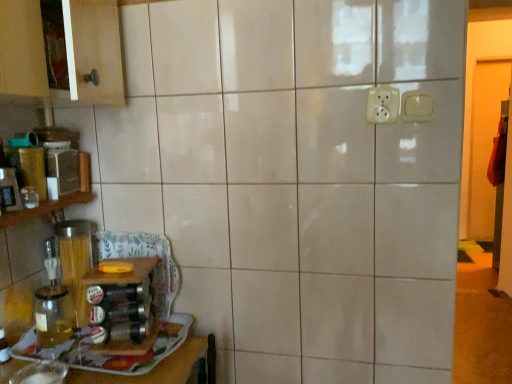
Question: Are wooden shelf at left and matte plastic container at left located far from each other?

Choices:
 (A) yes
 (B) no

Answer: (B)

Question: From the image's perspective, is wooden shelf at left on top of matte plastic container at left?

Choices:
 (A) yes
 (B) no

Answer: (B)

Question: Could you tell me if wooden shelf at left is turned towards matte plastic container at left?

Choices:
 (A) yes
 (B) no

Answer: (A)

Question: Can you confirm if wooden shelf at left is positioned to the right of matte plastic container at left?

Choices:
 (A) no
 (B) yes

Answer: (A)

Question: From a real-world perspective, does wooden shelf at left stand above matte plastic container at left?

Choices:
 (A) no
 (B) yes

Answer: (A)

Question: From the image's perspective, is wooden shelf at left located beneath matte plastic container at left?

Choices:
 (A) no
 (B) yes

Answer: (B)

Question: Is transparent glass jar at left positioned behind matte plastic container at left?

Choices:
 (A) yes
 (B) no

Answer: (B)

Question: Can you confirm if transparent glass jar at left is wider than matte plastic container at left?

Choices:
 (A) yes
 (B) no

Answer: (A)

Question: Does transparent glass jar at left have a smaller size compared to matte plastic container at left?

Choices:
 (A) no
 (B) yes

Answer: (B)

Question: Considering the relative sizes of transparent glass jar at left and matte plastic container at left in the image provided, is transparent glass jar at left taller than matte plastic container at left?

Choices:
 (A) no
 (B) yes

Answer: (A)

Question: Is transparent glass jar at left with matte plastic container at left?

Choices:
 (A) no
 (B) yes

Answer: (A)

Question: Considering the relative sizes of transparent glass jar at left and matte plastic container at left in the image provided, is transparent glass jar at left thinner than matte plastic container at left?

Choices:
 (A) no
 (B) yes

Answer: (A)

Question: Is the position of white plastic electric outlet at upper center, which ranks as the second electric outlet in right-to-left order, more distant than that of matte plastic container at left?

Choices:
 (A) yes
 (B) no

Answer: (B)